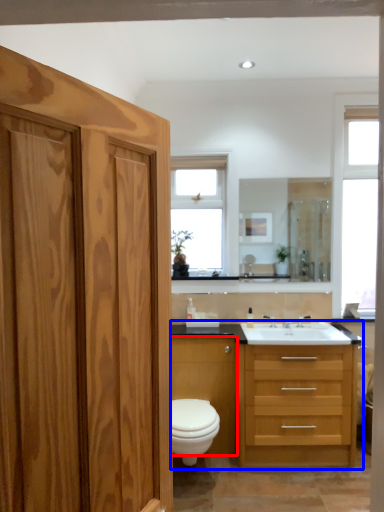
Question: Which of the following is the farthest to the observer, cabinetry (highlighted by a red box) or bathroom cabinet (highlighted by a blue box)?

Choices:
 (A) cabinetry
 (B) bathroom cabinet

Answer: (A)